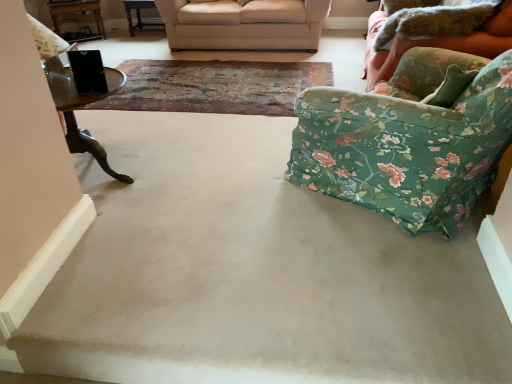
Question: From the image's perspective, is floral fabric armchair at right above floral fabric studio couch at right, the 2th studio couch positioned from the back?

Choices:
 (A) yes
 (B) no

Answer: (B)

Question: Can you confirm if floral fabric armchair at right is smaller than floral fabric studio couch at right, the 1th studio couch positioned from the right?

Choices:
 (A) yes
 (B) no

Answer: (A)

Question: Is floral fabric armchair at right positioned beyond the bounds of floral fabric studio couch at right, the 2th studio couch viewed from the left?

Choices:
 (A) no
 (B) yes

Answer: (B)

Question: From the image's perspective, would you say floral fabric armchair at right is shown under floral fabric studio couch at right, the 2th studio couch positioned from the back?

Choices:
 (A) yes
 (B) no

Answer: (A)

Question: Is floral fabric armchair at right aimed at floral fabric studio couch at right, the first studio couch when ordered from front to back?

Choices:
 (A) yes
 (B) no

Answer: (B)

Question: From a real-world perspective, is floral fabric armchair at right physically above floral fabric studio couch at right, the 1th studio couch positioned from the right?

Choices:
 (A) no
 (B) yes

Answer: (B)

Question: Is worn leather mat at center far away from beige fabric couch at upper center, arranged as the 1th studio couch when viewed from the left?

Choices:
 (A) yes
 (B) no

Answer: (B)

Question: Is the surface of worn leather mat at center in direct contact with beige fabric couch at upper center, arranged as the 1th studio couch when viewed from the left?

Choices:
 (A) no
 (B) yes

Answer: (A)

Question: From the image's perspective, is worn leather mat at center below beige fabric couch at upper center, acting as the second studio couch starting from the front?

Choices:
 (A) no
 (B) yes

Answer: (B)

Question: From a real-world perspective, is worn leather mat at center located higher than beige fabric couch at upper center, acting as the second studio couch starting from the front?

Choices:
 (A) yes
 (B) no

Answer: (B)

Question: From a real-world perspective, is worn leather mat at center positioned under beige fabric couch at upper center, acting as the second studio couch starting from the front, based on gravity?

Choices:
 (A) no
 (B) yes

Answer: (B)

Question: Is the depth of worn leather mat at center less than that of beige fabric couch at upper center, which is the first studio couch in back-to-front order?

Choices:
 (A) no
 (B) yes

Answer: (B)

Question: Can you see worn leather mat at center touching wooden table at upper left, the first table when ordered from left to right?

Choices:
 (A) no
 (B) yes

Answer: (A)